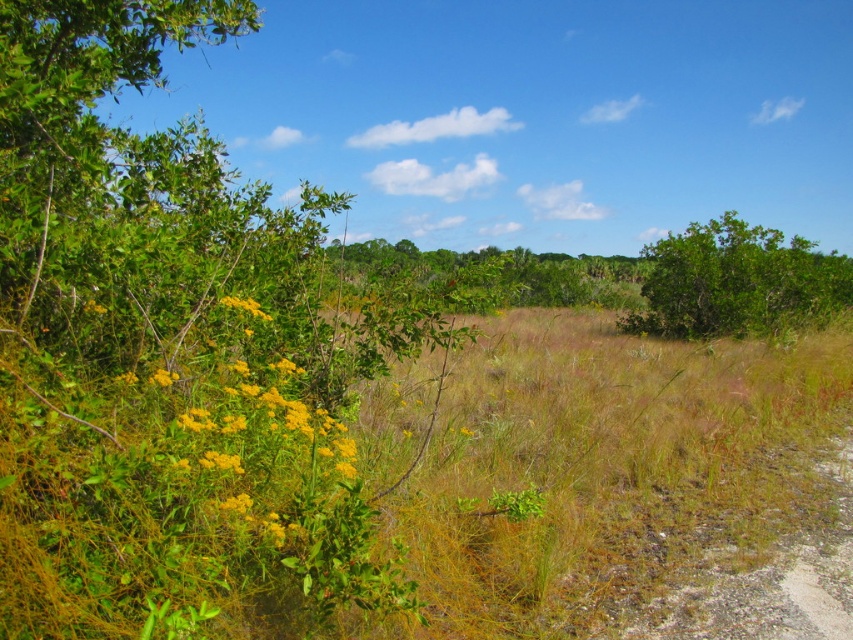
Between yellow matte flowers at left and green leafy bush at upper right, which one has less height?

Standing shorter between the two is yellow matte flowers at left.

How much distance is there between yellow matte flowers at left and green leafy bush at upper right?

yellow matte flowers at left and green leafy bush at upper right are 13.84 meters apart from each other.

Identify the location of yellow matte flowers at left. This screenshot has width=853, height=640. (252, 435).

Identify the location of yellow matte flowers at left. The height and width of the screenshot is (640, 853). (252, 435).